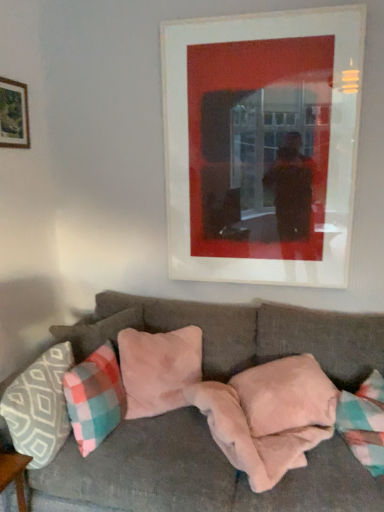
Question: In which direction should I rotate to look at matte white picture frame at upper center, acting as the 1th picture frame starting from the right?

Choices:
 (A) left
 (B) right

Answer: (B)

Question: Considering the relative positions of velvet gray couch at center and wooden frame at upper left, which ranks as the 2th picture frame in right-to-left order, in the image provided, is velvet gray couch at center behind wooden frame at upper left, which ranks as the 2th picture frame in right-to-left order,?

Choices:
 (A) yes
 (B) no

Answer: (B)

Question: Is velvet gray couch at center positioned beyond the bounds of wooden frame at upper left, which ranks as the 2th picture frame in right-to-left order?

Choices:
 (A) yes
 (B) no

Answer: (A)

Question: From a real-world perspective, is velvet gray couch at center on wooden frame at upper left, positioned as the 1th picture frame in left-to-right order?

Choices:
 (A) yes
 (B) no

Answer: (B)

Question: Does velvet gray couch at center have a greater height compared to wooden frame at upper left, which ranks as the 2th picture frame in right-to-left order?

Choices:
 (A) no
 (B) yes

Answer: (B)

Question: Are velvet gray couch at center and wooden frame at upper left, which ranks as the 2th picture frame in right-to-left order, located far from each other?

Choices:
 (A) yes
 (B) no

Answer: (A)

Question: Is velvet gray couch at center in front of wooden frame at upper left, positioned as the 1th picture frame in left-to-right order?

Choices:
 (A) no
 (B) yes

Answer: (B)

Question: Can you confirm if pink plush pillow at center, the fifth pillow when ordered from left to right, is bigger than fuzzy pink blanket at lower center?

Choices:
 (A) no
 (B) yes

Answer: (A)

Question: From a real-world perspective, is pink plush pillow at center, the fifth pillow when ordered from left to right, positioned under fuzzy pink blanket at lower center based on gravity?

Choices:
 (A) no
 (B) yes

Answer: (A)

Question: Considering the relative sizes of pink plush pillow at center, the fifth pillow when ordered from left to right, and fuzzy pink blanket at lower center in the image provided, is pink plush pillow at center, the fifth pillow when ordered from left to right, smaller than fuzzy pink blanket at lower center?

Choices:
 (A) no
 (B) yes

Answer: (B)

Question: From a real-world perspective, does pink plush pillow at center, the fifth pillow when ordered from left to right, stand above fuzzy pink blanket at lower center?

Choices:
 (A) yes
 (B) no

Answer: (A)

Question: From the image's perspective, does pink plush pillow at center, arranged as the 1th pillow when viewed from the right, appear lower than fuzzy pink blanket at lower center?

Choices:
 (A) yes
 (B) no

Answer: (B)

Question: Is the depth of pink plush pillow at center, arranged as the 1th pillow when viewed from the right, less than that of fuzzy pink blanket at lower center?

Choices:
 (A) yes
 (B) no

Answer: (B)

Question: From a real-world perspective, is matte white picture frame at upper center, acting as the 1th picture frame starting from the right, positioned over pink suede pillow at center, marked as the fourth pillow in a right-to-left arrangement, based on gravity?

Choices:
 (A) yes
 (B) no

Answer: (A)